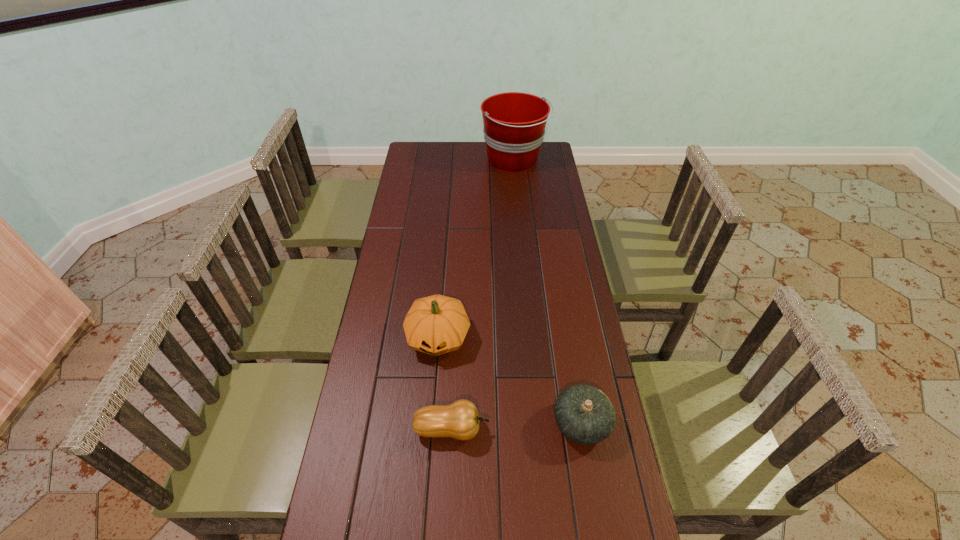
Locate an element on the screen. vacant area that lies between the second tallest gourd and the shortest gourd is located at coordinates (516, 426).

The height and width of the screenshot is (540, 960). Identify the location of vacant space in between the farthest object and the farthest gourd. (476, 248).

The width and height of the screenshot is (960, 540). Identify the location of free space between the second shortest gourd and the tallest object. (547, 292).

Where is `empty space between the shortest gourd and the second farthest object`? This screenshot has width=960, height=540. empty space between the shortest gourd and the second farthest object is located at coordinates (x=444, y=383).

At what (x,y) coordinates should I click in order to perform the action: click on free space between the shortest object and the tallest gourd. Please return your answer as a coordinate pair (x, y). This screenshot has width=960, height=540. Looking at the image, I should click on (444, 383).

Where is `vacant space that is in between the farthest object and the shortest object`? The width and height of the screenshot is (960, 540). vacant space that is in between the farthest object and the shortest object is located at coordinates (483, 294).

At what (x,y) coordinates should I click in order to perform the action: click on free spot between the second tallest object and the second tallest gourd. Please return your answer as a coordinate pair (x, y). The image size is (960, 540). Looking at the image, I should click on (510, 380).

Where is `free space between the shortest object and the tallest gourd`? This screenshot has width=960, height=540. free space between the shortest object and the tallest gourd is located at coordinates (444, 383).

I want to click on empty space that is in between the shortest gourd and the bucket, so click(483, 294).

Where is `object that ranks as the closest to the farthest object`? The height and width of the screenshot is (540, 960). object that ranks as the closest to the farthest object is located at coordinates (437, 324).